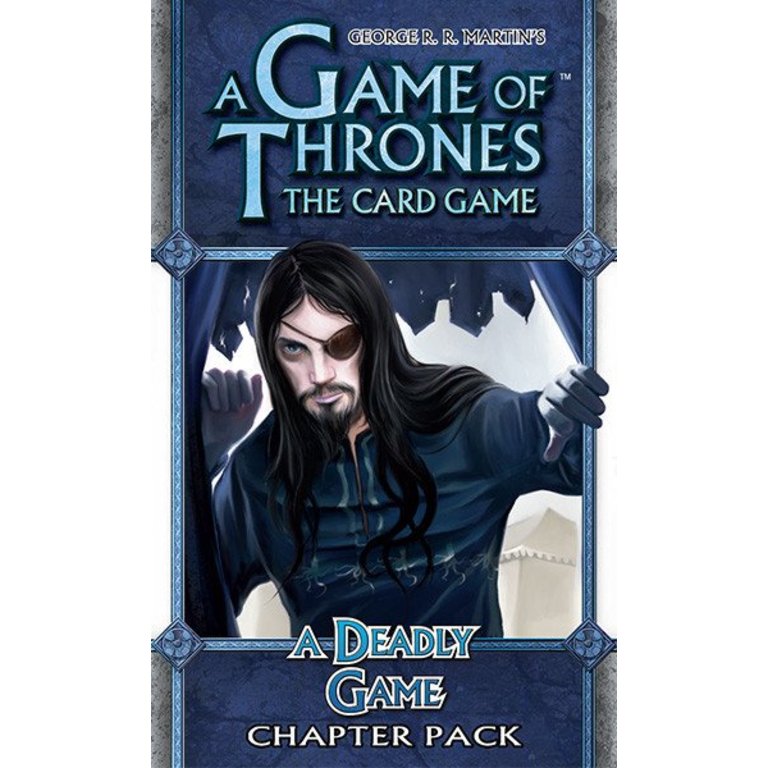
Image resolution: width=768 pixels, height=768 pixels. I want to click on box, so click(x=234, y=703).